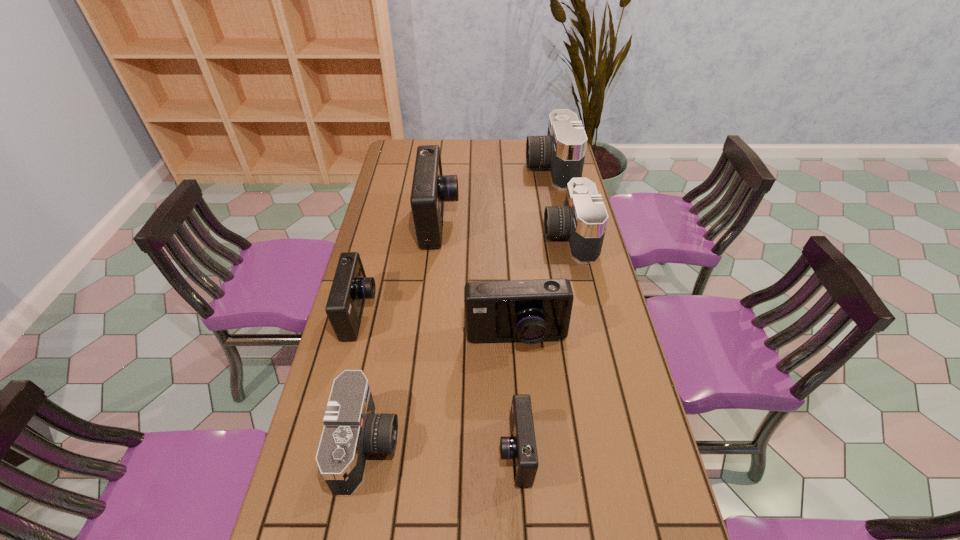
Identify the location of the shortest object. (521, 446).

Where is `vacant space located 0.250m on the front-facing side of the biggest blue camera`? The image size is (960, 540). vacant space located 0.250m on the front-facing side of the biggest blue camera is located at coordinates (523, 221).

The image size is (960, 540). I want to click on vacant space located on the front-facing side of the farthest camera, so click(x=488, y=168).

Locate an element on the screen. The width and height of the screenshot is (960, 540). free point located on the front-facing side of the farthest camera is located at coordinates (452, 168).

This screenshot has width=960, height=540. What are the coordinates of `vacant space located on the front-facing side of the farthest camera` in the screenshot? It's located at (494, 168).

Find the location of a particular element. This screenshot has width=960, height=540. free space located 0.310m on the front-facing side of the second biggest blue camera is located at coordinates (525, 467).

You are a GUI agent. You are given a task and a screenshot of the screen. Output one action in this format:
    pyautogui.click(x=<x>, y=<y>)
    Task: Click on the free space located on the front-facing side of the second farthest black camera
    
    Given the screenshot: What is the action you would take?
    pyautogui.click(x=485, y=237)

This screenshot has height=540, width=960. Identify the location of vacant area situated on the front-facing side of the second farthest black camera. (509, 237).

Identify the location of vacant area situated on the front-facing side of the second farthest black camera. (466, 237).

The width and height of the screenshot is (960, 540). Identify the location of vacant position located 0.310m on the front-facing side of the leftmost blue camera. [475, 313].